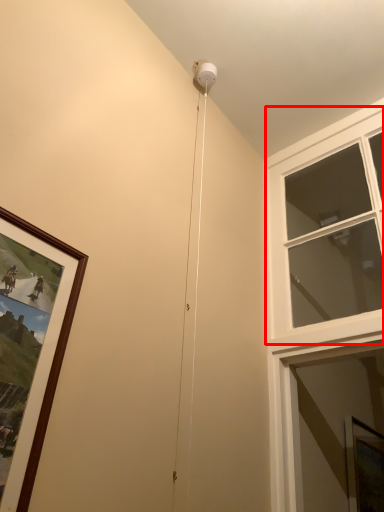
Question: In this image, where is window (annotated by the red box) located relative to window screen?

Choices:
 (A) left
 (B) right

Answer: (A)